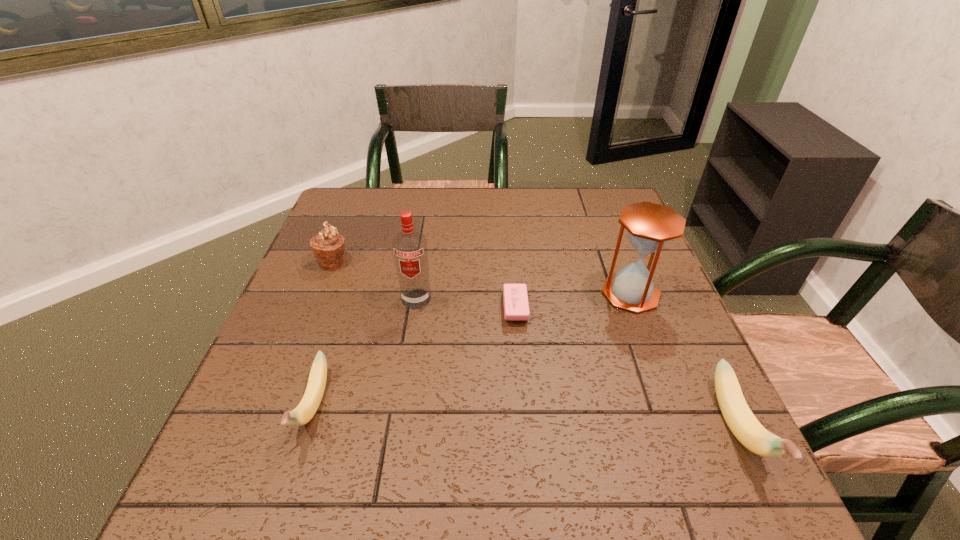
You are a GUI agent. You are given a task and a screenshot of the screen. Output one action in this format:
    pyautogui.click(x=<x>, y=<y>)
    Task: Click on the vacant space located 0.230m on the right of the muffin
    The image size is (960, 540).
    Given the screenshot: What is the action you would take?
    pyautogui.click(x=437, y=262)

At what (x,y) coordinates should I click in order to perform the action: click on vacant area located 0.130m on the back of the eraser. Please return your answer as a coordinate pair (x, y). Looking at the image, I should click on (511, 257).

The width and height of the screenshot is (960, 540). Identify the location of free space located 0.190m on the back of the fifth object from left to right. (608, 232).

Where is `blank space located 0.210m on the front label of the third object from left to right`? blank space located 0.210m on the front label of the third object from left to right is located at coordinates (402, 386).

Locate an element on the screen. banana at the left edge is located at coordinates (303, 413).

This screenshot has height=540, width=960. Identify the location of muffin present at the left edge. (328, 246).

This screenshot has height=540, width=960. I want to click on banana located in the right edge section of the desktop, so click(743, 424).

Identify the location of hourglass situated at the right edge. point(650,226).

The height and width of the screenshot is (540, 960). Find the location of `object that is at the near left corner`. object that is at the near left corner is located at coordinates (303, 413).

Locate an element on the screen. object that is at the near right corner is located at coordinates (743, 424).